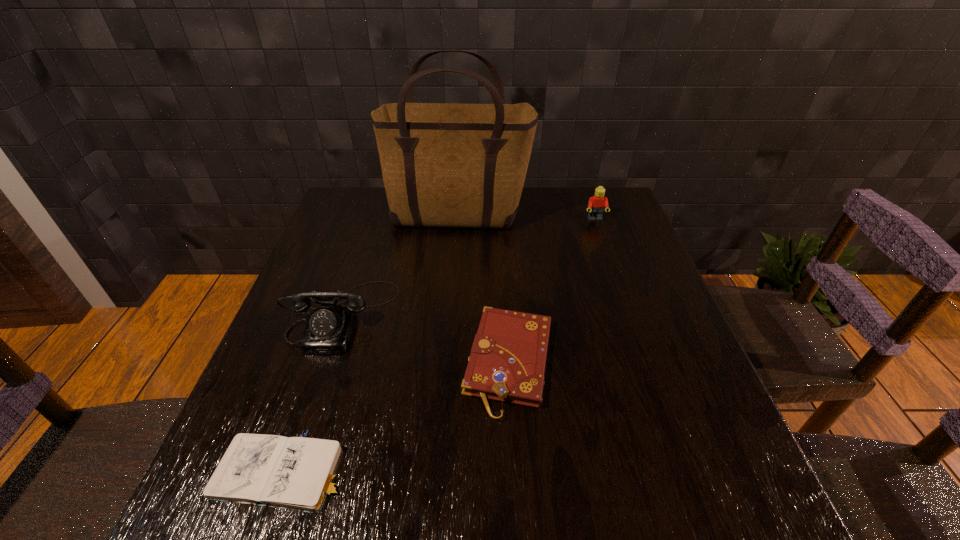
I want to click on the tallest object, so click(x=456, y=165).

The width and height of the screenshot is (960, 540). What are the coordinates of `the rightmost object` in the screenshot? It's located at (596, 204).

The image size is (960, 540). I want to click on telephone, so click(x=329, y=328).

The height and width of the screenshot is (540, 960). Find the location of `the taller notebook`. the taller notebook is located at coordinates (507, 361).

At what (x,y) coordinates should I click in order to perform the action: click on the right notebook. Please return your answer as a coordinate pair (x, y). Looking at the image, I should click on (507, 361).

Where is `the left notebook`? the left notebook is located at coordinates (296, 473).

Locate an element on the screen. This screenshot has width=960, height=540. the nearest object is located at coordinates (296, 473).

Locate an element on the screen. This screenshot has width=960, height=540. free location located on the back of the tote bag is located at coordinates (461, 189).

Where is `free point located on the face of the Lego`? free point located on the face of the Lego is located at coordinates (601, 237).

Where is `free space located 0.170m on the front-facing side of the telephone`? free space located 0.170m on the front-facing side of the telephone is located at coordinates (302, 427).